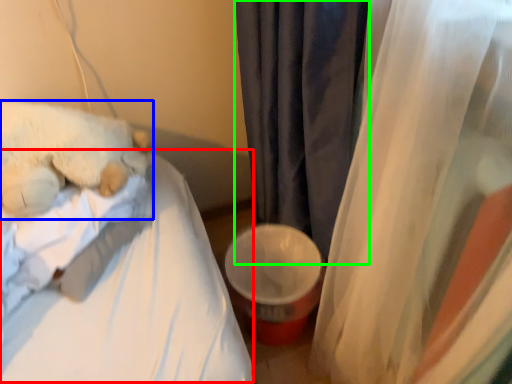
Question: Estimate the real-world distances between objects in this image. Which object is closer to mattress (highlighted by a red box), teddy bear (highlighted by a blue box) or curtain (highlighted by a green box)?

Choices:
 (A) teddy bear
 (B) curtain

Answer: (A)